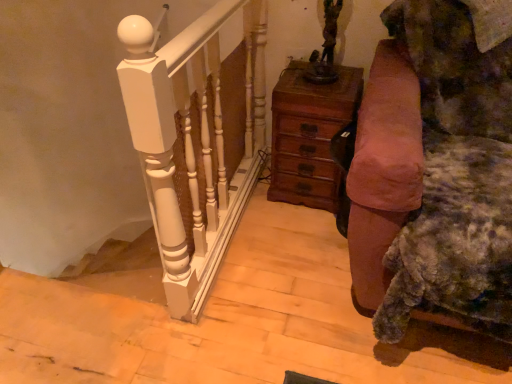
Question: From the image's perspective, is wooden chest of drawers at center beneath velvet brown couch at right?

Choices:
 (A) yes
 (B) no

Answer: (B)

Question: Does wooden chest of drawers at center lie behind velvet brown couch at right?

Choices:
 (A) yes
 (B) no

Answer: (A)

Question: From the image's perspective, is wooden chest of drawers at center located above velvet brown couch at right?

Choices:
 (A) no
 (B) yes

Answer: (B)

Question: Is wooden chest of drawers at center in contact with velvet brown couch at right?

Choices:
 (A) no
 (B) yes

Answer: (A)

Question: Is the position of wooden chest of drawers at center less distant than that of velvet brown couch at right?

Choices:
 (A) no
 (B) yes

Answer: (A)

Question: Can you confirm if wooden chest of drawers at center is positioned to the left of velvet brown couch at right?

Choices:
 (A) no
 (B) yes

Answer: (B)

Question: Is velvet brown couch at right not within wooden chest of drawers at center?

Choices:
 (A) yes
 (B) no

Answer: (A)

Question: From a real-world perspective, is velvet brown couch at right physically below wooden chest of drawers at center?

Choices:
 (A) no
 (B) yes

Answer: (A)

Question: Considering the relative sizes of velvet brown couch at right and wooden chest of drawers at center in the image provided, is velvet brown couch at right bigger than wooden chest of drawers at center?

Choices:
 (A) no
 (B) yes

Answer: (B)

Question: Is velvet brown couch at right taller than wooden chest of drawers at center?

Choices:
 (A) yes
 (B) no

Answer: (A)

Question: Considering the relative positions of velvet brown couch at right and wooden chest of drawers at center in the image provided, is velvet brown couch at right behind wooden chest of drawers at center?

Choices:
 (A) no
 (B) yes

Answer: (A)

Question: From a real-world perspective, is velvet brown couch at right positioned over wooden chest of drawers at center based on gravity?

Choices:
 (A) yes
 (B) no

Answer: (A)

Question: In the image, is wooden chest of drawers at center on the left side or the right side of velvet brown couch at right?

Choices:
 (A) right
 (B) left

Answer: (B)